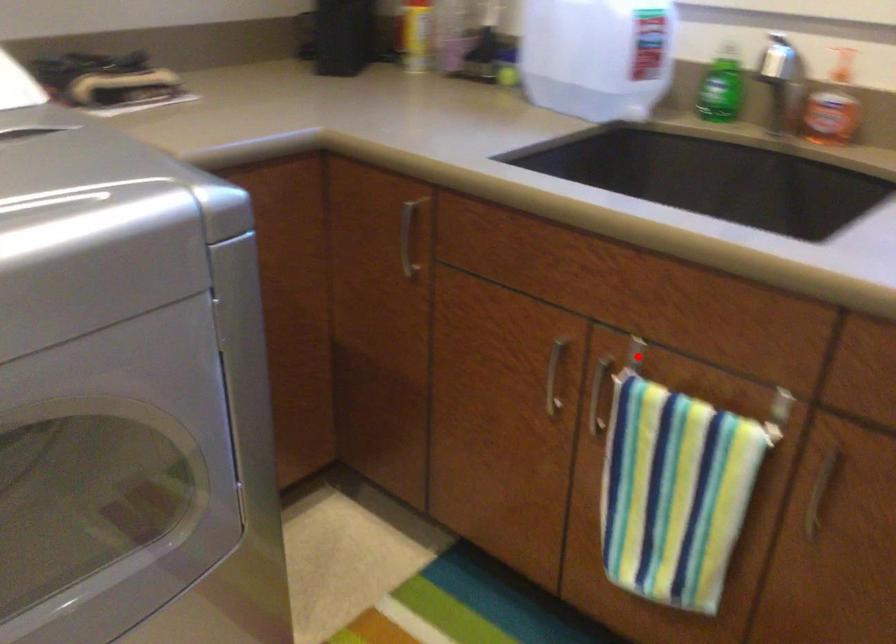
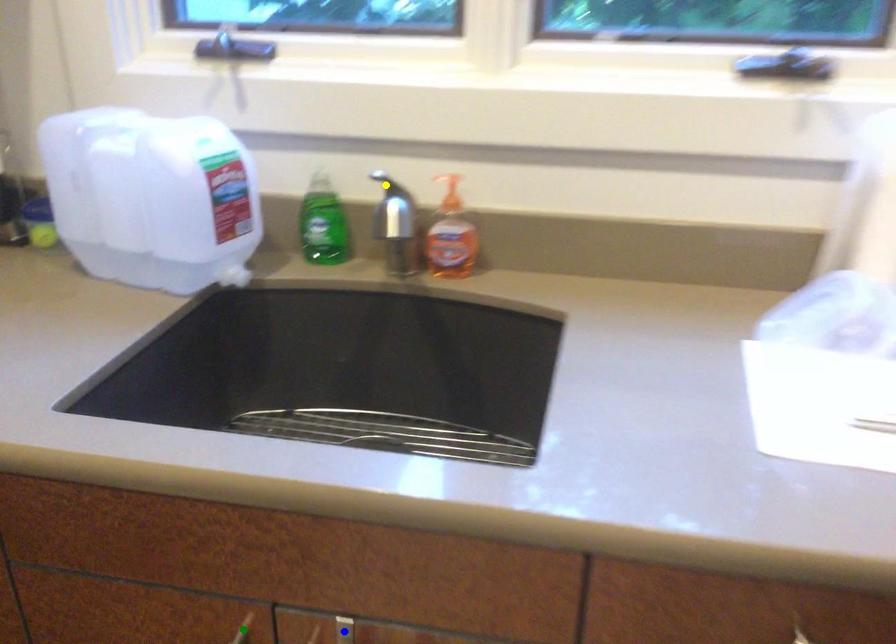
Question: I am providing you with two images of the same scene from different viewpoints. A red point is marked on the first image. You are given multiple points on the second image. Can you choose the point in image 2 that corresponds to the point in image 1?

Choices:
 (A) green point
 (B) yellow point
 (C) blue point

Answer: (C)